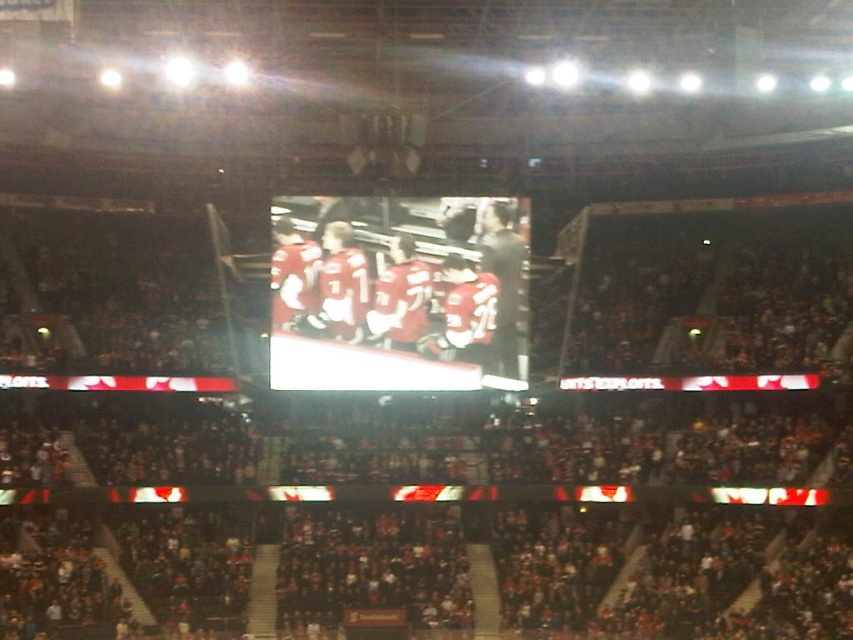
You are a photographer trying to capture a photo of the matte red jersey at center while standing behind the dark gray stadium seats at center. Can you fit the entire jersey into your camera frame without moving the camera? Explain why or why not.

The dark gray stadium seats at center are wider than the matte red jersey at center. Since the seats are wider, they might block part of the jersey from view, making it difficult to capture the entire jersey in the frame without adjusting your position or the camera angle.

In the scene shown: You are a photographer trying to capture the celebration of the hockey players. You have two points marked in the arena that you want to focus on. The first point is at coordinate point (639, 518), and the second is at coordinate point (338, 211). Which point is closer to you when you take the photo?

Point (639, 518) is closer to the viewer than point (338, 211).

You are a photographer trying to capture a photo of the matte red jersey at center while avoiding the dark gray stadium seats at center. Given their sizes, which object should you focus on to ensure the jersey is clearly visible without obstruction?

The dark gray stadium seats at center is larger in size than the matte red jersey at center, so focusing on the matte red jersey at center will ensure it is clearly visible without obstruction from the larger seats.